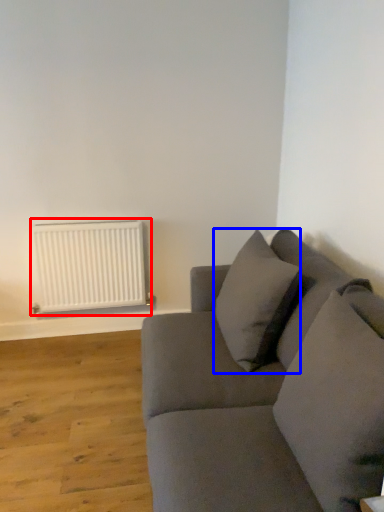
Question: Which object is further to the camera taking this photo, radiator (highlighted by a red box) or pillow (highlighted by a blue box)?

Choices:
 (A) radiator
 (B) pillow

Answer: (A)